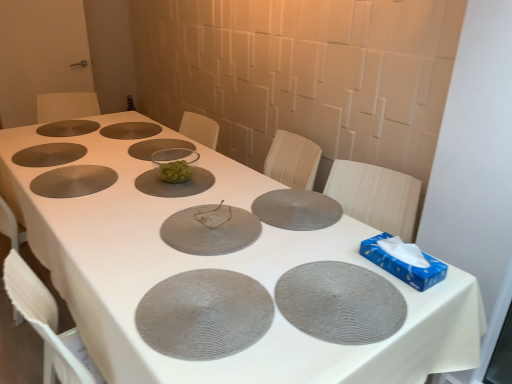
Locate an element on the screen. The image size is (512, 384). free area in between gray textured placemat at center, positioned as the 10th glass plate in back-to-front order, and gray textured placemat at lower right, which ranks as the second glass plate in front-to-back order is located at coordinates (283, 319).